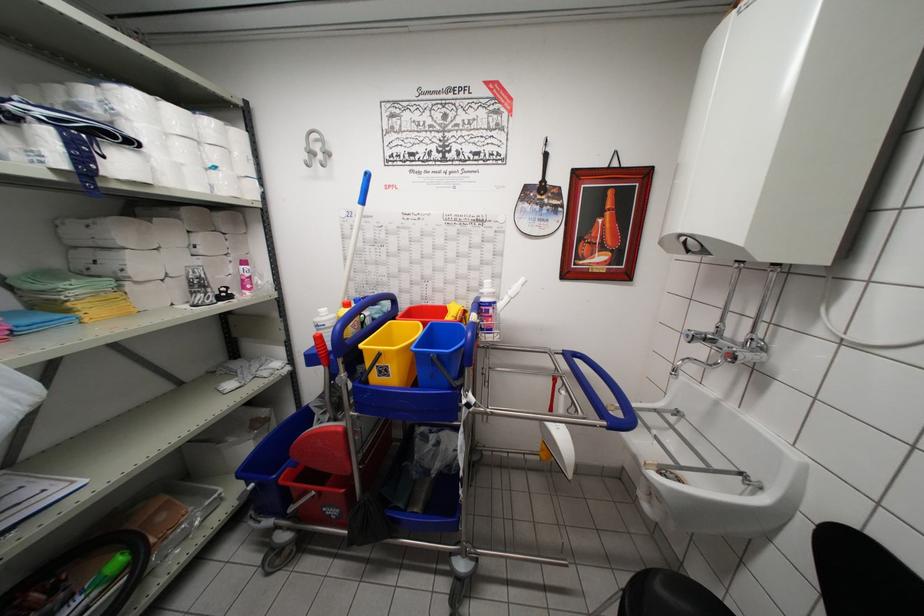
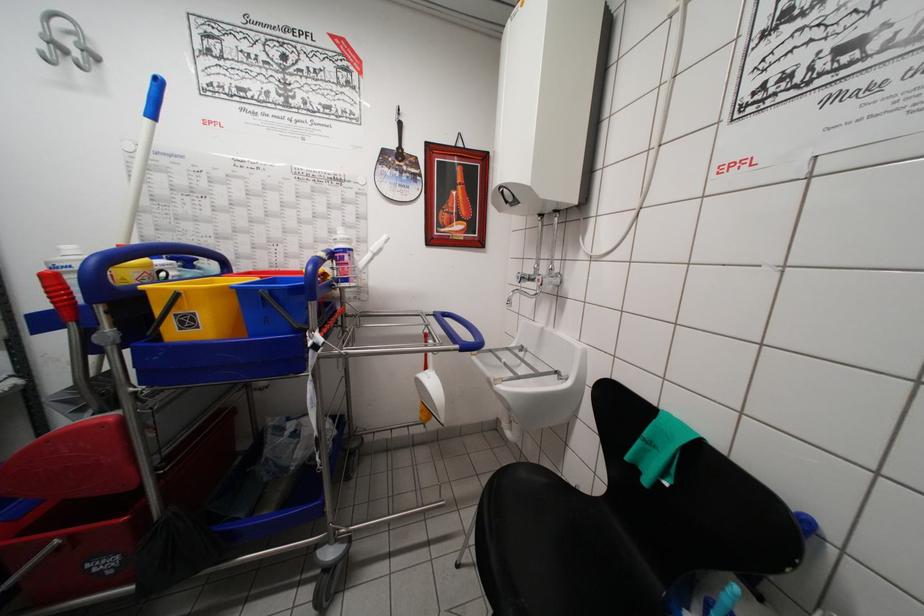
Where in the second image is the point corresponding to point (609, 428) from the first image?

(460, 351)